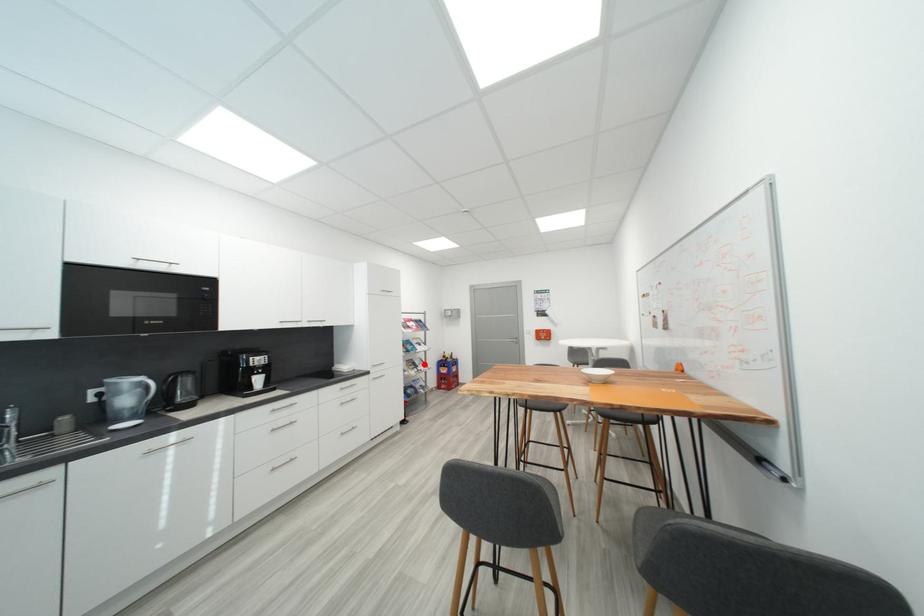
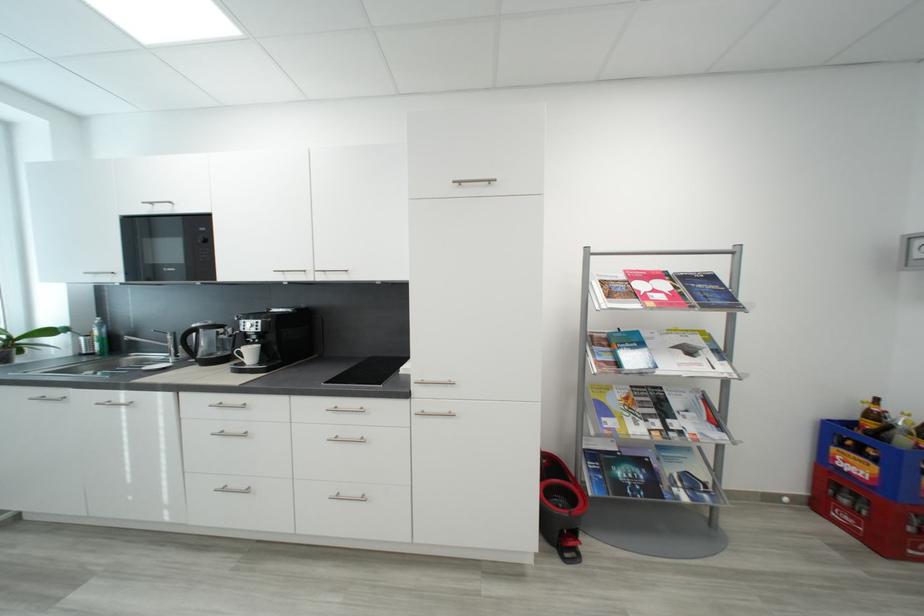
Find the pixel in the second image that matches the highlighted location in the first image.

(684, 406)